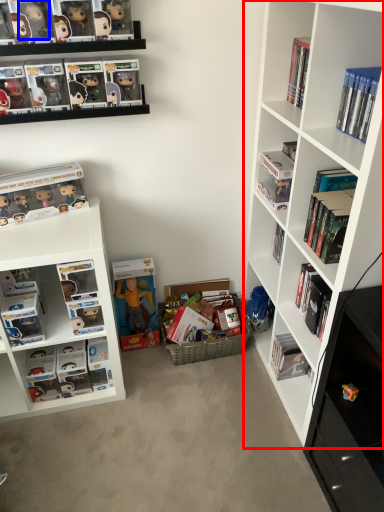
Question: Among these objects, which one is farthest to the camera, shelf (highlighted by a red box) or toy (highlighted by a blue box)?

Choices:
 (A) shelf
 (B) toy

Answer: (B)